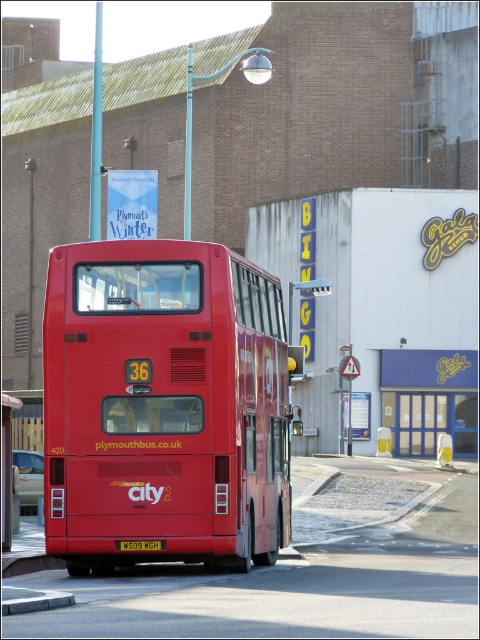
You are a pedestrian standing on the sidewalk next to the matte red bus at center. You want to see the yellow matte license plate at rear without moving your feet. Which direction should you turn your head?

The matte red bus at center is positioned over the yellow matte license plate at rear, so you need to look downward to see the yellow matte license plate at rear.

You are a delivery driver who needs to park your van, which is 5 meters long, between the matte red bus at center and the metallic silver pole at left. Is there enough space for your van?

The distance between the matte red bus at center and the metallic silver pole at left is 5.21 meters. Since your van is 5 meters long, there is sufficient space to park it between them.

You are a pedestrian standing on the sidewalk next to the metallic silver pole at left. You want to check the license plate number of the yellow matte license plate at rear on the bus. Can you see the license plate clearly from your current position?

The metallic silver pole at left is further to the viewer than yellow matte license plate at rear, so you are behind the pole relative to the license plate. This means the pole might block your view of the license plate. You should move around the pole to get a clear view.